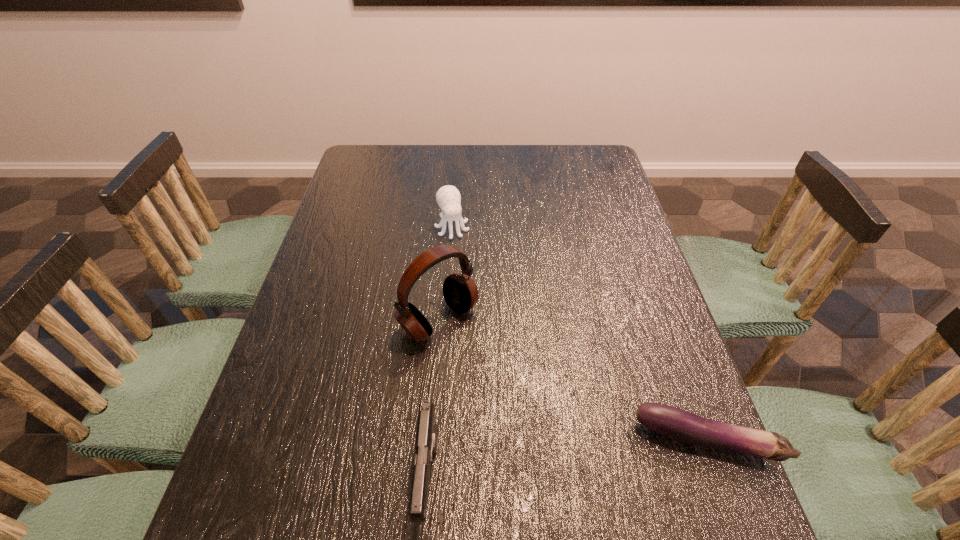
You are a GUI agent. You are given a task and a screenshot of the screen. Output one action in this format:
    pyautogui.click(x=<x>, y=<y>)
    Task: Click on the free space located on the front-facing side of the octopus
    The width and height of the screenshot is (960, 540).
    Given the screenshot: What is the action you would take?
    pyautogui.click(x=472, y=285)

You are a GUI agent. You are given a task and a screenshot of the screen. Output one action in this format:
    pyautogui.click(x=<x>, y=<y>)
    Task: Click on the free location located 0.080m on the front-facing side of the octopus
    The image size is (960, 540).
    Given the screenshot: What is the action you would take?
    pyautogui.click(x=463, y=259)

Where is `vacant region located 0.180m on the front-facing side of the octopus`? vacant region located 0.180m on the front-facing side of the octopus is located at coordinates (472, 285).

Locate an element on the screen. This screenshot has height=540, width=960. pistol at the near edge is located at coordinates (426, 440).

The width and height of the screenshot is (960, 540). I want to click on eggplant present at the near edge, so click(680, 425).

Identify the location of object at the right edge. (680, 425).

Find the location of a particular element. The height and width of the screenshot is (540, 960). object present at the near right corner is located at coordinates (680, 425).

Identify the location of vacant area at the far edge. (538, 154).

The width and height of the screenshot is (960, 540). I want to click on free space at the near edge of the desktop, so click(x=338, y=483).

The height and width of the screenshot is (540, 960). Find the location of `free location at the left edge`. free location at the left edge is located at coordinates (343, 330).